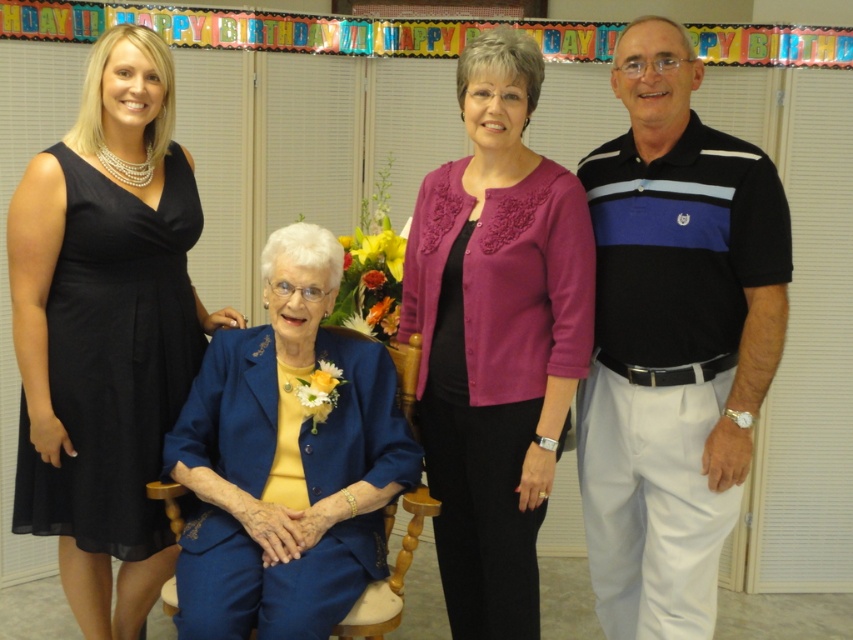
Which is above, black striped polo shirt at right or purple embroidered cardigan at center?

black striped polo shirt at right

Consider the image. Who is more distant from viewer, (x=683, y=188) or (x=488, y=403)?

Positioned behind is point (x=488, y=403).

You are a GUI agent. You are given a task and a screenshot of the screen. Output one action in this format:
    pyautogui.click(x=<x>, y=<y>)
    Task: Click on the black striped polo shirt at right
    The width and height of the screenshot is (853, 640).
    Given the screenshot: What is the action you would take?
    pyautogui.click(x=672, y=340)

Between point (541, 180) and point (190, 612), which one is positioned behind?

The point (541, 180) is more distant.

Is purple embroidered cardigan at center smaller than blue satin suit at center?

Incorrect, purple embroidered cardigan at center is not smaller in size than blue satin suit at center.

Is point (451, 525) positioned behind point (302, 371)?

Yes.

You are a GUI agent. You are given a task and a screenshot of the screen. Output one action in this format:
    pyautogui.click(x=<x>, y=<y>)
    Task: Click on the purple embroidered cardigan at center
    The image size is (853, 640).
    Given the screenshot: What is the action you would take?
    pyautogui.click(x=496, y=337)

Does black chiffon dress at left have a lesser height compared to purple embroidered cardigan at center?

No.

Does point (123, 301) come in front of point (496, 611)?

No, (123, 301) is behind (496, 611).

Is point (47, 525) more distant than point (467, 417)?

Yes, point (47, 525) is farther from viewer.

Where is `black chiffon dress at left`? black chiffon dress at left is located at coordinates (106, 330).